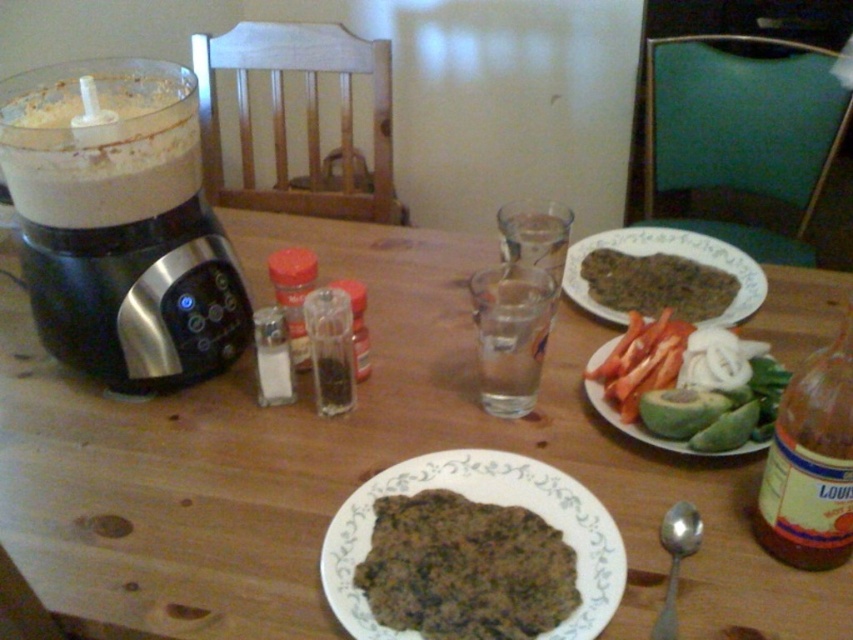
Between white creamy milkshake at left and brown glass bottle at right, which one appears on the right side from the viewer's perspective?

brown glass bottle at right

Is the position of white creamy milkshake at left more distant than that of brown glass bottle at right?

Yes, white creamy milkshake at left is further from the viewer.

Who is more distant from viewer, (105,212) or (781,490)?

Positioned behind is point (105,212).

The image size is (853, 640). Find the location of `white creamy milkshake at left`. white creamy milkshake at left is located at coordinates (99, 141).

Does brown matte flatbread at upper right have a lesser width compared to satin silver spoon at lower right?

Incorrect, brown matte flatbread at upper right's width is not less than satin silver spoon at lower right's.

Who is lower down, brown matte flatbread at upper right or satin silver spoon at lower right?

satin silver spoon at lower right is below.

The height and width of the screenshot is (640, 853). In order to click on brown matte flatbread at upper right in this screenshot , I will do `click(656, 284)`.

This screenshot has width=853, height=640. I want to click on brown matte flatbread at upper right, so click(656, 284).

What do you see at coordinates (465, 568) in the screenshot? I see `dark brown crumbly at center` at bounding box center [465, 568].

Does dark brown crumbly at center appear over red glass spice at center?

Incorrect, dark brown crumbly at center is not positioned above red glass spice at center.

Is point (413, 538) more distant than point (299, 348)?

No, (413, 538) is closer to viewer.

Identify the location of dark brown crumbly at center. (465, 568).